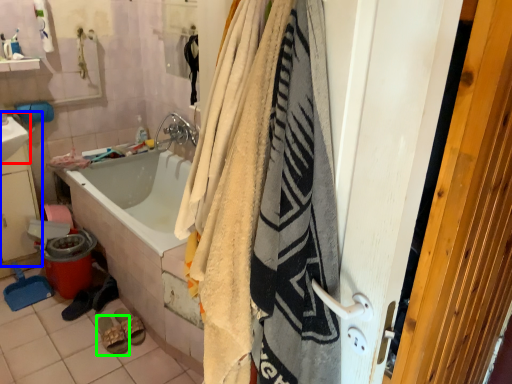
Question: Estimate the real-world distances between objects in this image. Which object is farther from sink (highlighted by a red box), sink (highlighted by a blue box) or footwear (highlighted by a green box)?

Choices:
 (A) sink
 (B) footwear

Answer: (B)